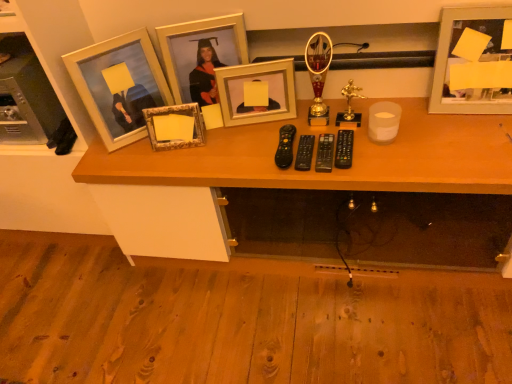
Find the location of a particular element. The image size is (512, 384). vacant space in front of matte wooden picture frame at left, the fifth picture frame when ordered from right to left is located at coordinates (144, 157).